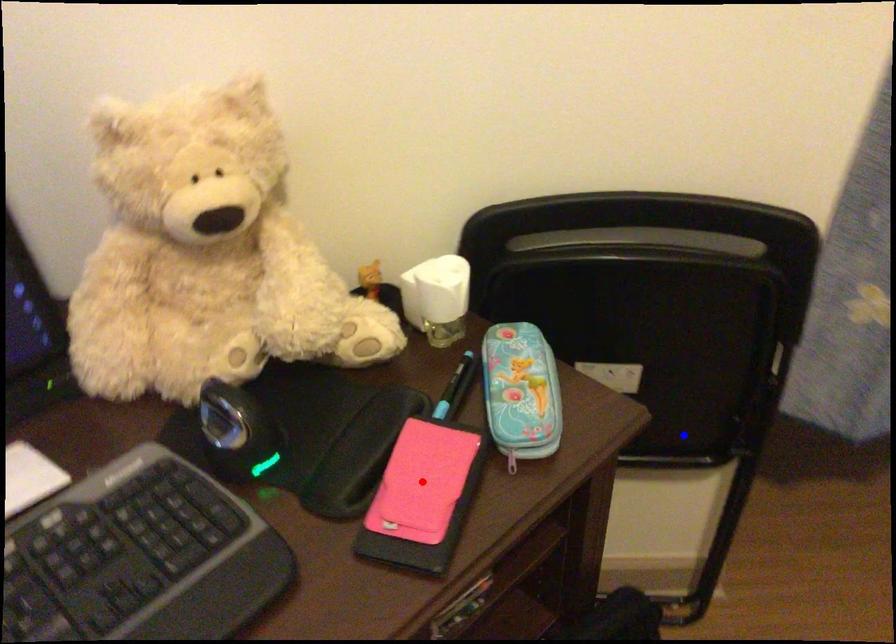
Question: Two points are marked on the image. Which point is closer to the camera?

Choices:
 (A) Blue point is closer.
 (B) Red point is closer.

Answer: (B)